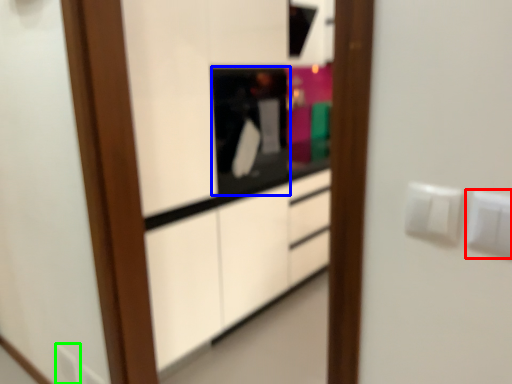
Question: Considering the real-world distances, which object is farthest from electric outlet (highlighted by a red box)? appliance (highlighted by a blue box) or electric outlet (highlighted by a green box)?

Choices:
 (A) appliance
 (B) electric outlet

Answer: (B)